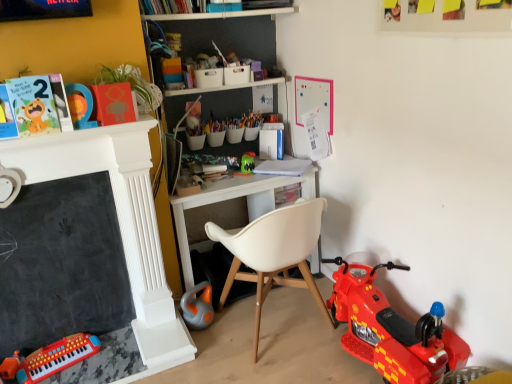
Question: Is black chalkboard at left facing away from matte paper card at upper left, arranged as the first book when viewed from the left?

Choices:
 (A) no
 (B) yes

Answer: (A)

Question: Can you confirm if black chalkboard at left is shorter than matte paper card at upper left, which is the 3th book from back to front?

Choices:
 (A) yes
 (B) no

Answer: (B)

Question: Does black chalkboard at left have a greater width compared to matte paper card at upper left, which appears as the 3th book when viewed from the right?

Choices:
 (A) yes
 (B) no

Answer: (B)

Question: Does black chalkboard at left have a greater height compared to matte paper card at upper left, which is the 3th book from back to front?

Choices:
 (A) no
 (B) yes

Answer: (B)

Question: Can you confirm if black chalkboard at left is smaller than matte paper card at upper left, the first book from the front?

Choices:
 (A) no
 (B) yes

Answer: (A)

Question: Is matte plastic number at upper left, the fourth toy from the right, bigger or smaller than shiny plastic toy motorcycle at lower right, positioned as the first toy in right-to-left order?

Choices:
 (A) big
 (B) small

Answer: (B)

Question: In terms of height, does matte plastic number at upper left, marked as the third toy in a left-to-right arrangement, look taller or shorter compared to shiny plastic toy motorcycle at lower right, the 6th toy in the left-to-right sequence?

Choices:
 (A) short
 (B) tall

Answer: (A)

Question: Does point (88, 92) appear closer or farther from the camera than point (399, 339)?

Choices:
 (A) farther
 (B) closer

Answer: (B)

Question: Is matte plastic number at upper left, the fourth toy from the right, spatially inside shiny plastic toy motorcycle at lower right, the 6th toy in the left-to-right sequence, or outside of it?

Choices:
 (A) outside
 (B) inside

Answer: (A)

Question: From the image's perspective, is matte paper card at upper left, which appears as the 3th book when viewed from the right, positioned above or below white plastic desk at center?

Choices:
 (A) above
 (B) below

Answer: (A)

Question: Based on their sizes in the image, would you say matte paper card at upper left, arranged as the first book when viewed from the left, is bigger or smaller than white plastic desk at center?

Choices:
 (A) small
 (B) big

Answer: (A)

Question: From their relative heights in the image, would you say matte paper card at upper left, which is the 3th book from back to front, is taller or shorter than white plastic desk at center?

Choices:
 (A) tall
 (B) short

Answer: (B)

Question: Considering their positions, is matte paper card at upper left, which appears as the 3th book when viewed from the right, located in front of or behind white plastic desk at center?

Choices:
 (A) front
 (B) behind

Answer: (A)

Question: Considering the relative positions of white paper at center, the first book in the right-to-left sequence, and green plastic toy at center, marked as the second toy in a right-to-left arrangement, in the image provided, is white paper at center, the first book in the right-to-left sequence, to the left or to the right of green plastic toy at center, marked as the second toy in a right-to-left arrangement,?

Choices:
 (A) left
 (B) right

Answer: (B)

Question: Would you say white paper at center, the first book in the right-to-left sequence, is inside or outside green plastic toy at center, the fifth toy from the left?

Choices:
 (A) inside
 (B) outside

Answer: (B)